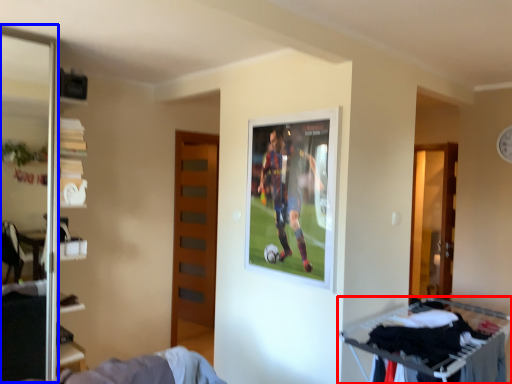
Question: Among these objects, which one is farthest to the camera, furniture (highlighted by a red box) or screen door (highlighted by a blue box)?

Choices:
 (A) furniture
 (B) screen door

Answer: (B)